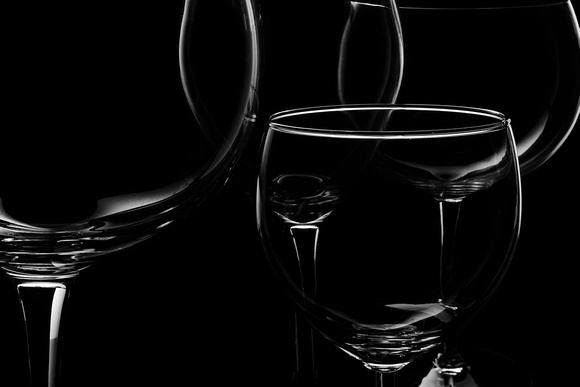
Find the location of `wine glasses`. wine glasses is located at coordinates click(x=496, y=60), click(x=443, y=183), click(x=351, y=66), click(x=162, y=122).